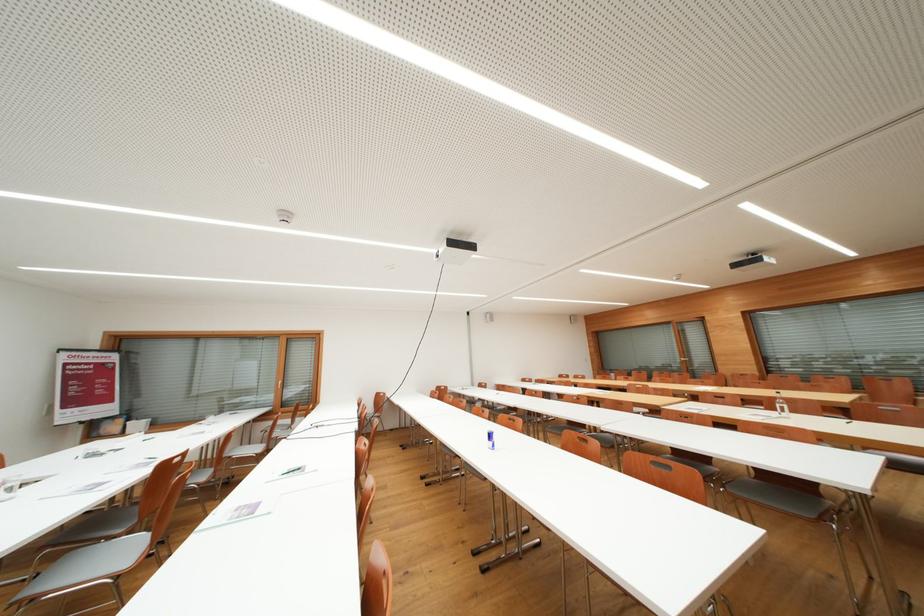
I want to click on silver window handle, so click(x=286, y=395).